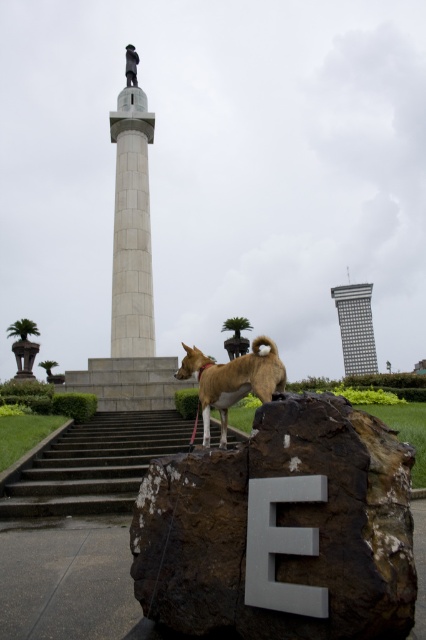
Between dark gray concrete stairs at lower left and golden fur dog at center, which one has less height?

Standing shorter between the two is dark gray concrete stairs at lower left.

Does dark gray concrete stairs at lower left have a lesser height compared to golden fur dog at center?

Yes, dark gray concrete stairs at lower left is shorter than golden fur dog at center.

The width and height of the screenshot is (426, 640). I want to click on dark gray concrete stairs at lower left, so click(95, 465).

Is golden fur dog at center wider than polished bronze statue at upper center?

Yes.

Is golden fur dog at center in front of polished bronze statue at upper center?

Yes, it is.

Is point (244, 388) closer to viewer compared to point (131, 54)?

Yes, point (244, 388) is in front of point (131, 54).

At what (x,y) coordinates should I click in order to perform the action: click on golden fur dog at center. Please return your answer as a coordinate pair (x, y). The height and width of the screenshot is (640, 426). Looking at the image, I should click on (233, 380).

Is brown rough rock at center positioned in front of golden fur dog at center?

Yes, brown rough rock at center is in front of golden fur dog at center.

Between brown rough rock at center and golden fur dog at center, which one is positioned lower?

brown rough rock at center

Is point (296, 566) farther from viewer compared to point (250, 353)?

That is False.

At what (x,y) coordinates should I click in order to perform the action: click on brown rough rock at center. Please return your answer as a coordinate pair (x, y). The image size is (426, 640). Looking at the image, I should click on (282, 529).